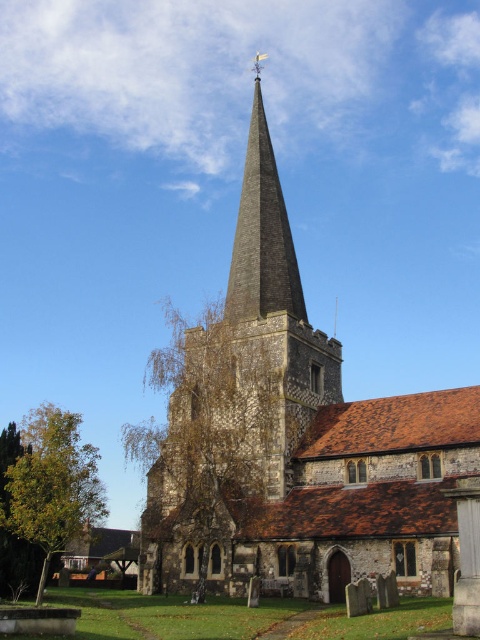
You are standing in front of the historic church and want to take a photo that includes both the stone steeple at center and the dark gray stone spire at center. Based on their positions, which one should you position to the left side of your camera frame?

You should position the stone steeple at center to the left side of your camera frame since it is located to the left of the dark gray stone spire at center.

You are standing at the entrance of the historic church and see the point marked at coordinates (x=294, y=442). What does this point indicate?

The point marked at coordinates (x=294, y=442) indicates the location of the stone steeple at center.